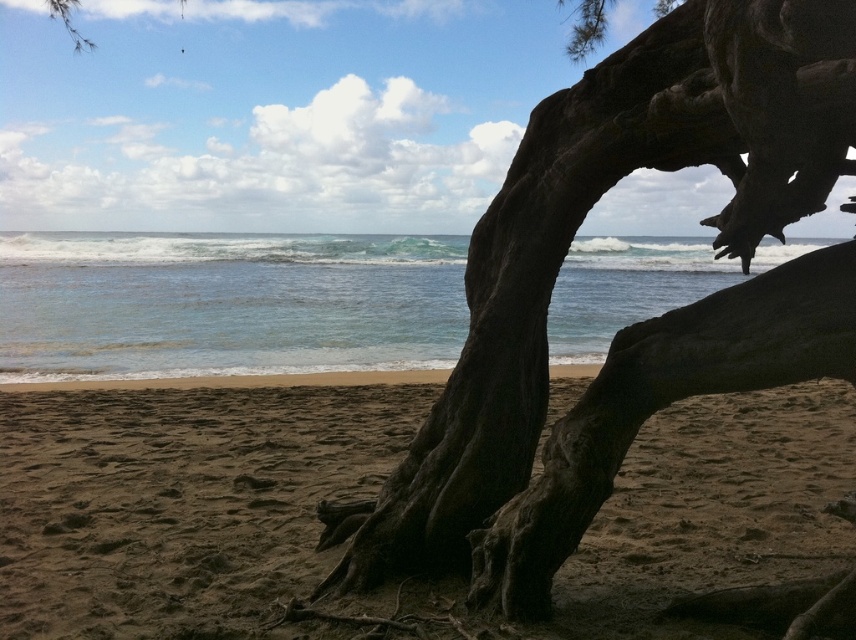
Is dark brown wood at center positioned behind clear blue water at center?

That is False.

Does dark brown wood at center appear on the left side of clear blue water at center?

In fact, dark brown wood at center is to the right of clear blue water at center.

What do you see at coordinates (634, 323) in the screenshot? The image size is (856, 640). I see `dark brown wood at center` at bounding box center [634, 323].

Find the location of `dark brown wood at center`. dark brown wood at center is located at coordinates (634, 323).

Can you confirm if brown sandy beach at lower center is taller than dark brown wood at center?

Incorrect, brown sandy beach at lower center's height is not larger of dark brown wood at center's.

Can you confirm if brown sandy beach at lower center is shorter than dark brown wood at center?

Correct, brown sandy beach at lower center is not as tall as dark brown wood at center.

This screenshot has height=640, width=856. I want to click on brown sandy beach at lower center, so click(372, 496).

Is brown sandy beach at lower center positioned before clear blue water at center?

No.

Is point (575, 582) more distant than point (421, 292)?

No, it is in front of (421, 292).

Locate an element on the screen. The width and height of the screenshot is (856, 640). brown sandy beach at lower center is located at coordinates (372, 496).